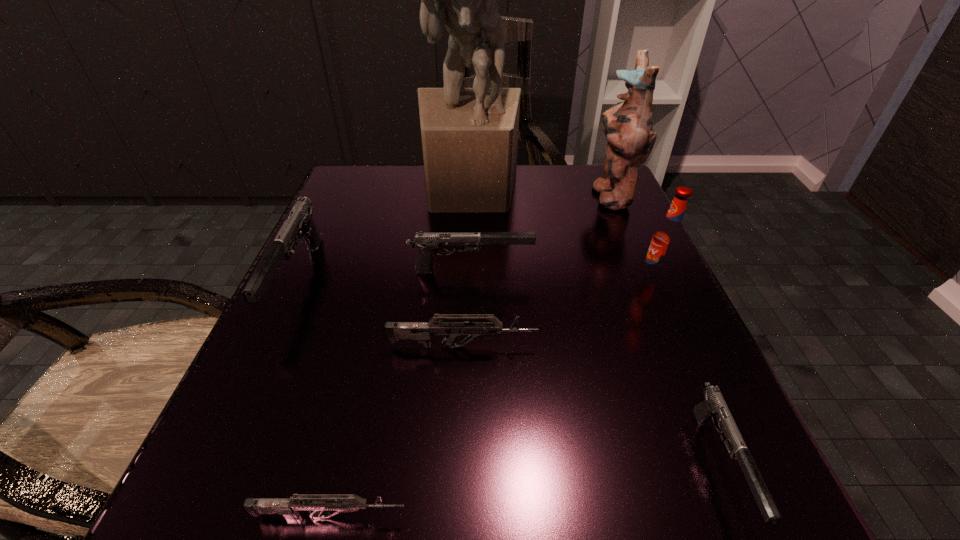
Find the location of a particular element. vacant space at the near edge of the desktop is located at coordinates (522, 503).

This screenshot has height=540, width=960. Identify the location of free spot at the left edge of the desktop. pos(339,348).

Where is `free region at the right edge of the desktop`? This screenshot has height=540, width=960. free region at the right edge of the desktop is located at coordinates (643, 456).

At what (x,y) coordinates should I click in order to perform the action: click on free space at the near left corner of the desktop. Please return your answer as a coordinate pair (x, y). The height and width of the screenshot is (540, 960). Looking at the image, I should click on (230, 485).

This screenshot has height=540, width=960. In order to click on vacant region at the far right corner of the desktop in this screenshot , I will do `click(591, 164)`.

Where is `vacant space at the near right corner`? The width and height of the screenshot is (960, 540). vacant space at the near right corner is located at coordinates (687, 522).

Where is `vacant space in between the tallest gun and the second gray gun from right to left`? This screenshot has width=960, height=540. vacant space in between the tallest gun and the second gray gun from right to left is located at coordinates (385, 275).

What are the coordinates of `free space between the leftmost object and the shortest gun` in the screenshot? It's located at (315, 399).

This screenshot has height=540, width=960. I want to click on vacant space that is in between the nearer grey gun and the figurine, so click(471, 356).

I want to click on empty space between the sculpture and the pink figurine, so click(x=540, y=191).